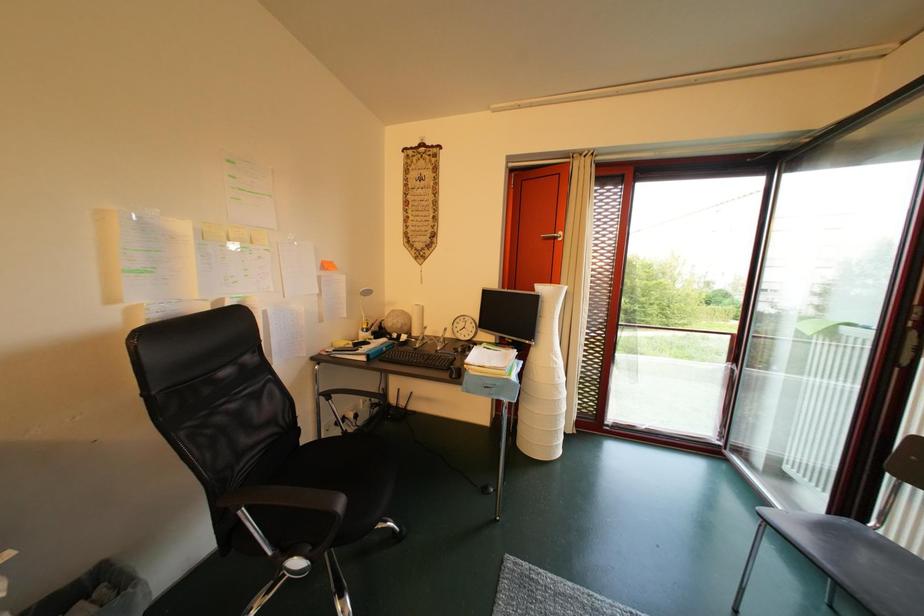
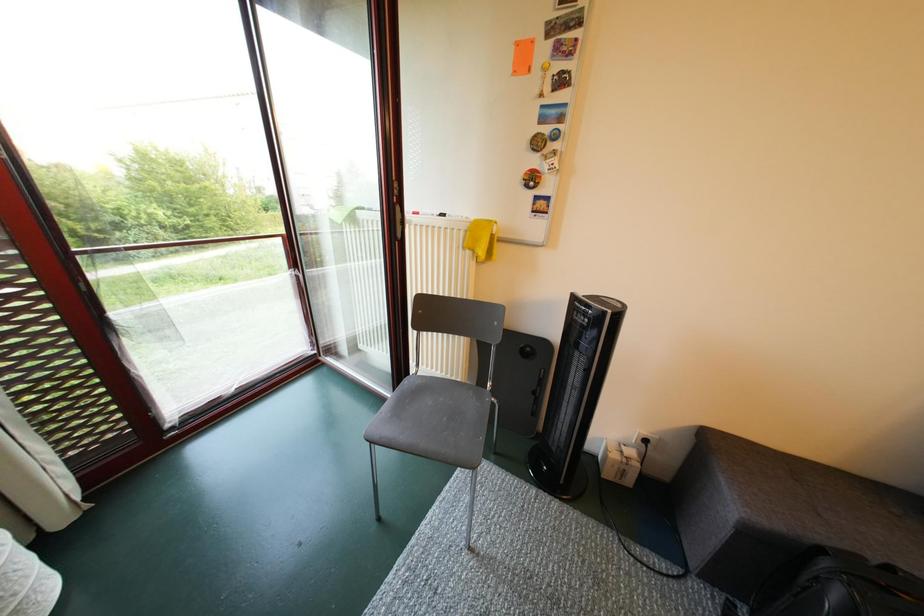
How did the camera likely rotate?

The camera's rotation is toward right-down.